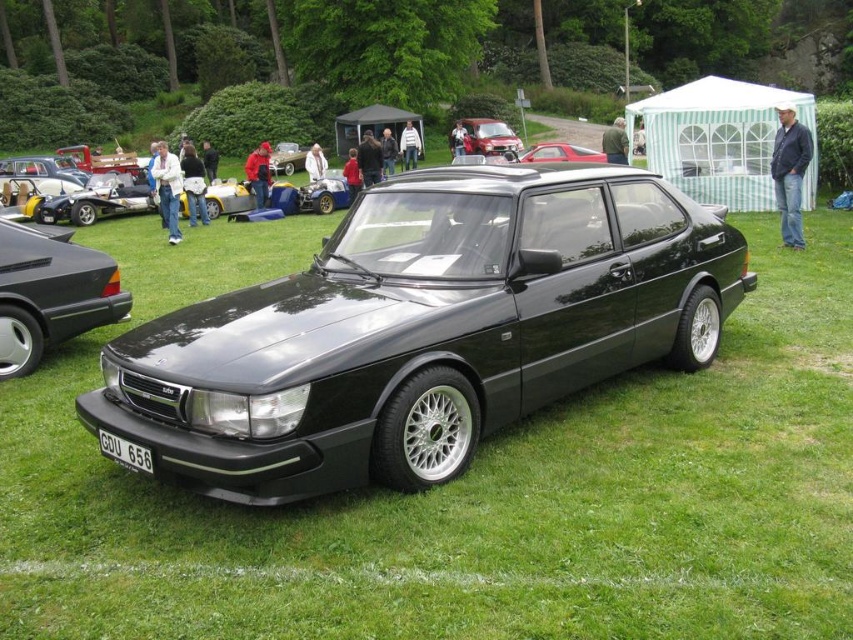
You are standing in the middle of a car exhibition where several vintage cars are displayed. You notice a point marked at coordinates (x=422, y=330). Which car does this point correspond to?

The point at coordinates (x=422, y=330) corresponds to the black metallic car at center.

You are a parking attendant at the car exhibition and need to park a new car that is 1.8 meters wide. You have two options between the metallic red car at center and the matte black car at center. Which car should you choose to park next to if you want to ensure enough space for the new car?

The metallic red car at center has a lesser width compared to the matte black car at center, so you should choose to park next to the metallic red car at center to ensure there is enough space for the new car that is 1.8 meters wide.